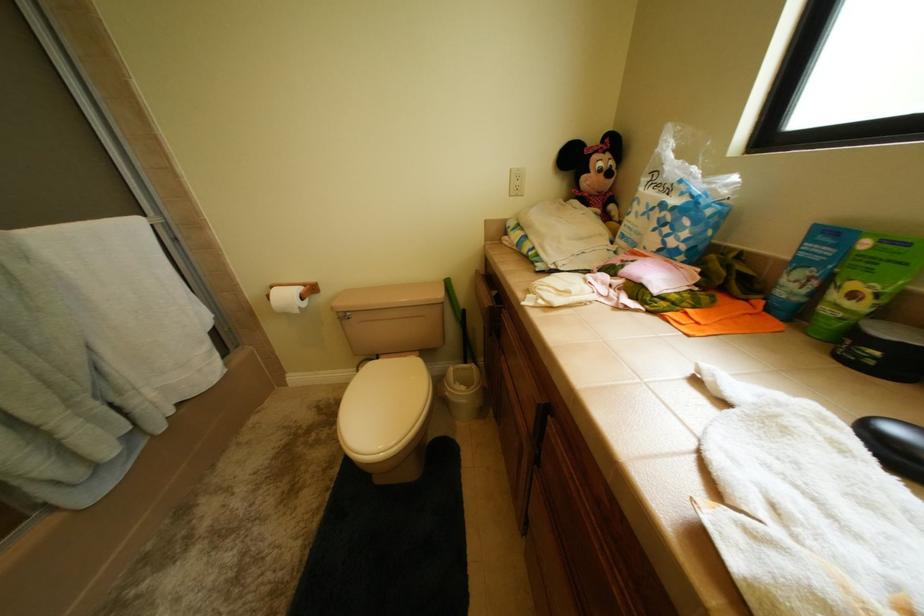
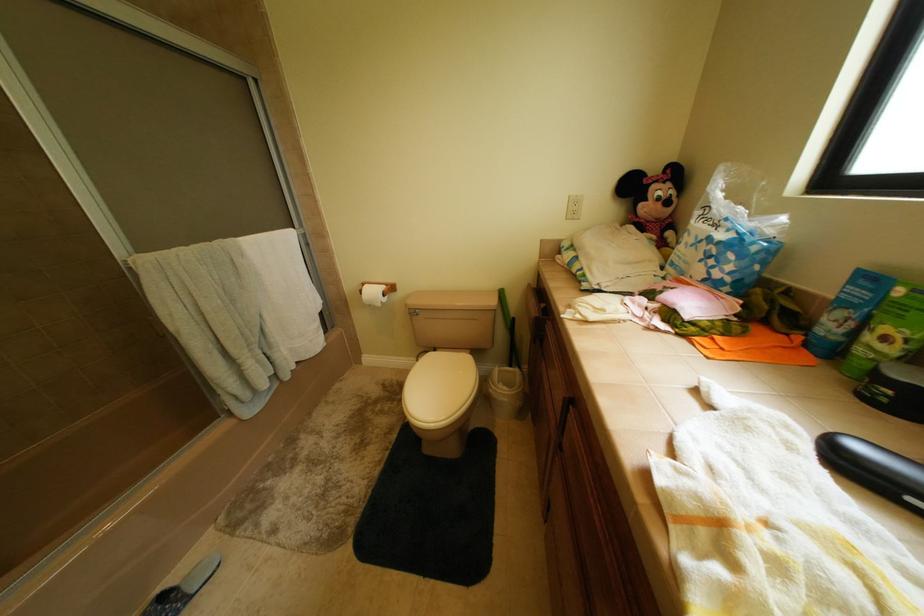
Question: How did the camera likely rotate?

Choices:
 (A) Left
 (B) Right
 (C) Up
 (D) Down

Answer: (A)